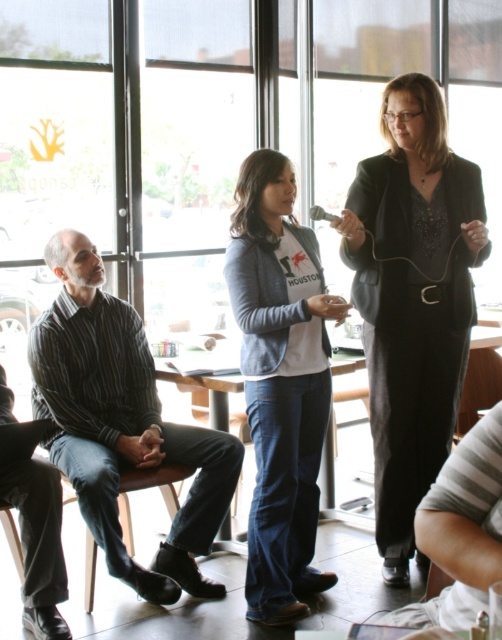
What is located at the point with coordinates (412, 300) in the image?

The black satin blazer at center is located at point (412, 300).

You are standing in the room and want to place a small table at the point marked as point (391, 529). If the table requires 3 meters of space from the camera to be placed safely, is the distance sufficient?

The distance of point (391, 529) from the camera is 3.22 meters, which is more than the required 3 meters, so the distance is sufficient to place the small table safely.